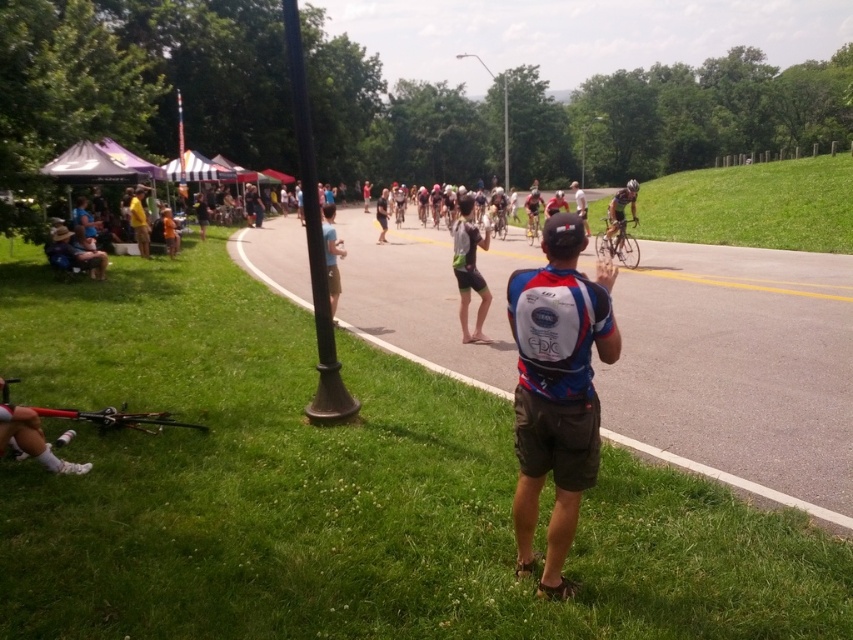
Is point (329, 228) farther from viewer compared to point (132, 196)?

No, it is not.

Between point (340, 244) and point (129, 211), which one is positioned in front?

Positioned in front is point (340, 244).

Find the location of a particular element. The height and width of the screenshot is (640, 853). light blue fabric shirt at center is located at coordinates (331, 253).

Does point (149, 554) lie behind point (515, 310)?

Yes.

In order to click on green grass at lower left in this screenshot , I will do `click(337, 492)`.

Describe the element at coordinates (337, 492) in the screenshot. This screenshot has width=853, height=640. I see `green grass at lower left` at that location.

At what (x,y) coordinates should I click in order to perform the action: click on green grass at lower left. Please return your answer as a coordinate pair (x, y). Image resolution: width=853 pixels, height=640 pixels. Looking at the image, I should click on (337, 492).

Who is higher up, yellow fabric tent at left or orange fabric at center?

orange fabric at center is higher up.

Can you confirm if yellow fabric tent at left is taller than orange fabric at center?

Correct, yellow fabric tent at left is much taller as orange fabric at center.

You are a GUI agent. You are given a task and a screenshot of the screen. Output one action in this format:
    pyautogui.click(x=<x>, y=<y>)
    Task: Click on the yellow fabric tent at left
    
    Given the screenshot: What is the action you would take?
    click(138, 220)

Identify the location of yellow fabric tent at left. (138, 220).